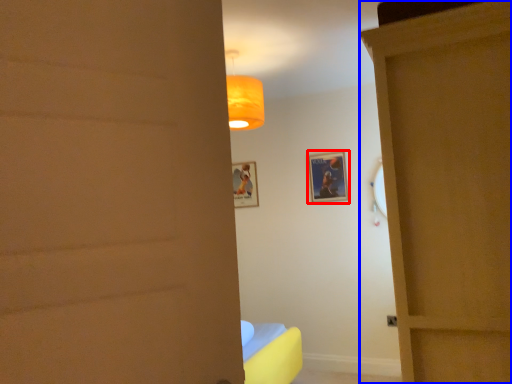
Question: Which object is closer to the camera taking this photo, picture frame (highlighted by a red box) or door (highlighted by a blue box)?

Choices:
 (A) picture frame
 (B) door

Answer: (B)